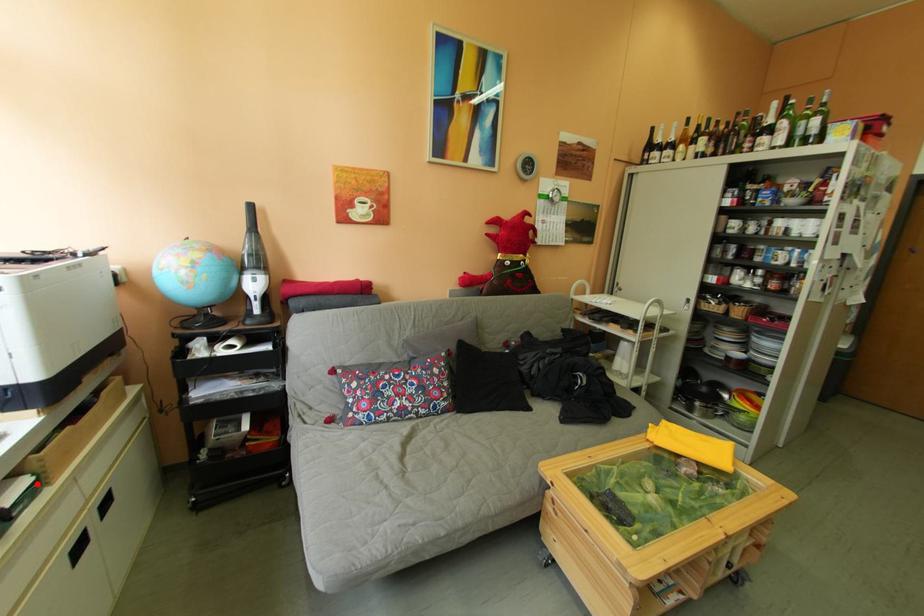
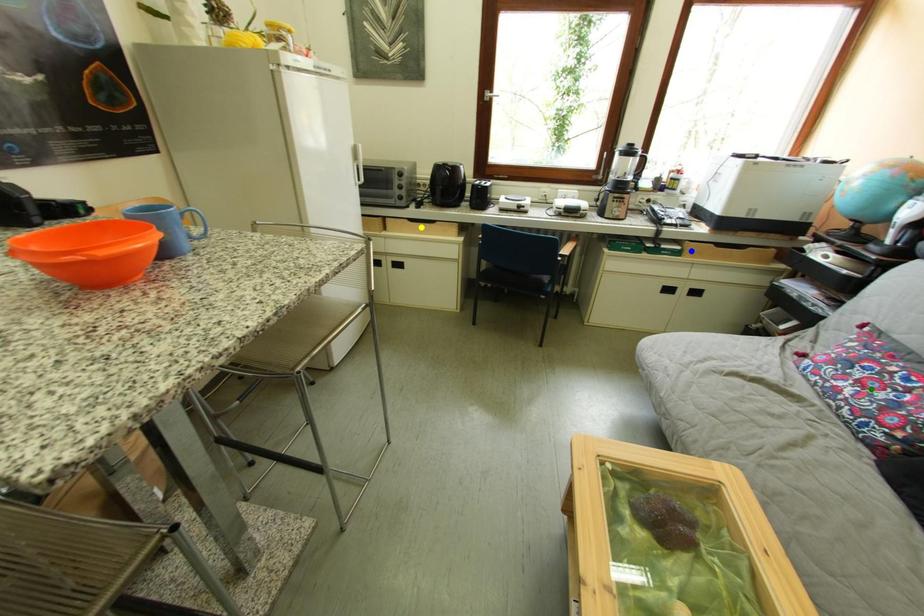
Question: I am providing you with two images of the same scene from different viewpoints. A red point is marked on the first image. You are given multiple points on the second image. In image 2, which mark is for the same physical point as the one in image 1?

Choices:
 (A) yellow point
 (B) green point
 (C) blue point

Answer: (C)